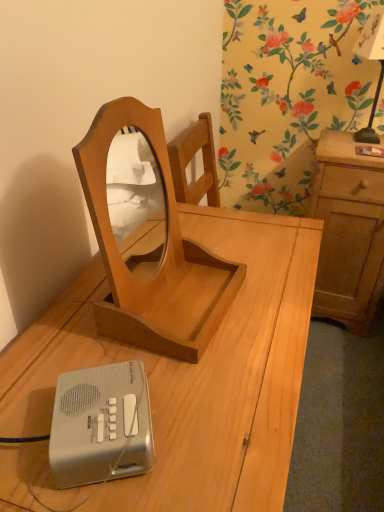
Locate an element on the screen. unoccupied area behind silver plastic ipod at lower left is located at coordinates (109, 345).